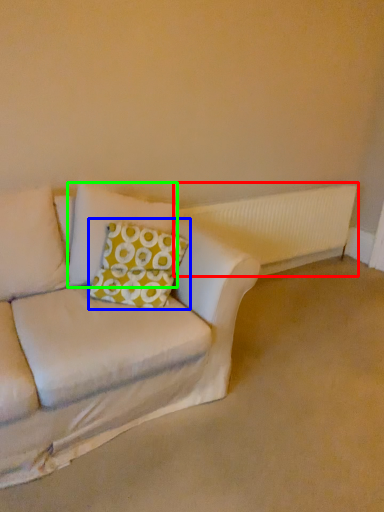
Question: Which object is the farthest from radiator (highlighted by a red box)? Choose among these: throw pillow (highlighted by a blue box) or pillow (highlighted by a green box).

Choices:
 (A) throw pillow
 (B) pillow

Answer: (A)